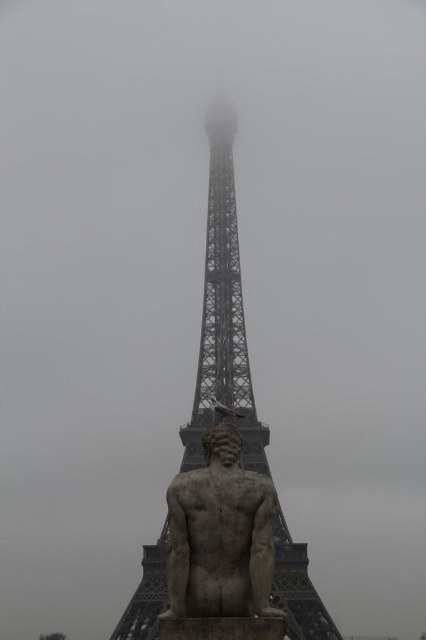
You are a photographer planning to capture a photo of the metallic gray eiffel tower at center and the stone statue at lower center. Which object should you focus on first if you want to ensure both are in sharp focus, considering their distances from the camera?

The metallic gray eiffel tower at center is taller than the stone statue at lower center, so you should focus on the metallic gray eiffel tower at center first since it is farther away and requires a smaller aperture for depth of field, ensuring both are in focus.

What is located at the coordinates point (222, 314) in the image?

The metallic gray eiffel tower at center is located at point (222, 314).

You are a photographer trying to capture the metallic gray eiffel tower at center and the stone statue at lower center in a single frame. Based on their sizes, which object should you focus on to ensure both are visible without zooming in or out?

The metallic gray eiffel tower at center might be wider than the stone statue at lower center, so focusing on the metallic gray eiffel tower at center would help ensure both are visible in the frame without needing to adjust the zoom.